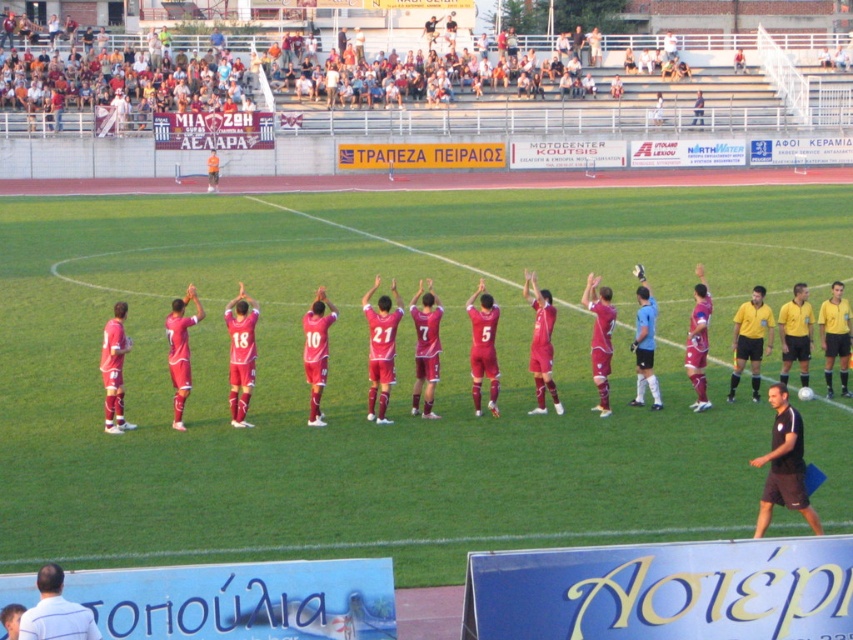
Between black short at lower right and white shirt at lower left, which one has less height?

white shirt at lower left is shorter.

Describe the element at coordinates (784, 465) in the screenshot. I see `black short at lower right` at that location.

Who is more forward, (792, 506) or (51, 595)?

Point (51, 595)

The height and width of the screenshot is (640, 853). In order to click on black short at lower right in this screenshot , I will do `click(784, 465)`.

Is white shirt at lower left thinner than matte red soccer uniform at center?

Yes.

Is point (36, 577) behind point (848, 408)?

No, it is in front of (848, 408).

Find the location of a particular element. The height and width of the screenshot is (640, 853). white shirt at lower left is located at coordinates (56, 611).

Does point (764, 460) come in front of point (753, 400)?

Yes, point (764, 460) is in front of point (753, 400).

In the scene shown: Who is shorter, black short at lower right or matte red soccer uniform at center?

With less height is black short at lower right.

Which is in front, point (798, 483) or point (585, 296)?

Point (798, 483) is in front.

Where is `black short at lower right`? Image resolution: width=853 pixels, height=640 pixels. black short at lower right is located at coordinates (784, 465).